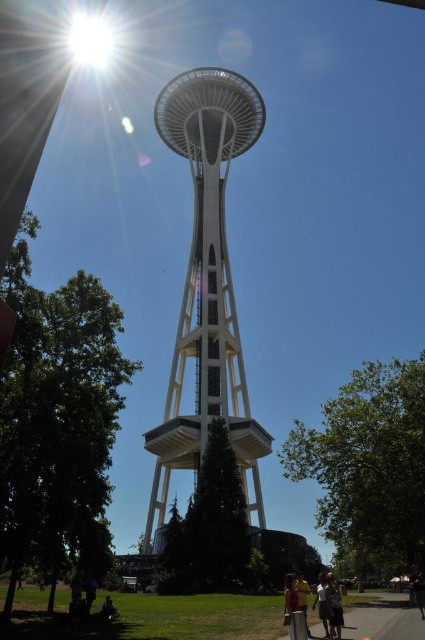
Which is below, dark brown hair at lower center or matte yellow shirt at lower center?

dark brown hair at lower center is lower down.

In order to click on dark brown hair at lower center in this screenshot , I will do (334, 608).

From the picture: Can you confirm if white glass tower at center is positioned below dark brown hair at lower center?

Actually, white glass tower at center is above dark brown hair at lower center.

Does point (158, 465) lie behind point (329, 616)?

Yes, it is behind point (329, 616).

Where is `white glass tower at center`? white glass tower at center is located at coordinates (206, 284).

Is white cotton shirt at lower center smaller than matte yellow shirt at lower center?

Yes.

Is white cotton shirt at lower center bigger than matte yellow shirt at lower center?

Actually, white cotton shirt at lower center might be smaller than matte yellow shirt at lower center.

The height and width of the screenshot is (640, 425). What do you see at coordinates (322, 602) in the screenshot? I see `white cotton shirt at lower center` at bounding box center [322, 602].

Where is `white cotton shirt at lower center`? white cotton shirt at lower center is located at coordinates (322, 602).